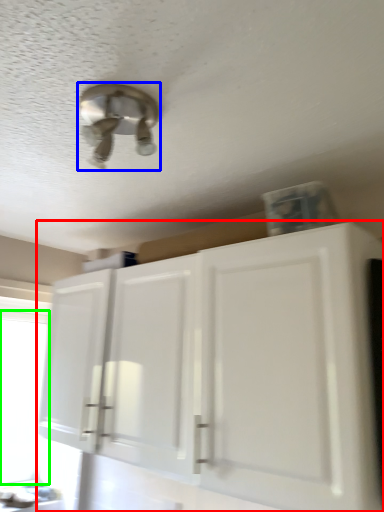
Question: Based on their relative distances, which object is nearer to cabinetry (highlighted by a red box)? Choose from light fixture (highlighted by a blue box) and window screen (highlighted by a green box).

Choices:
 (A) light fixture
 (B) window screen

Answer: (A)